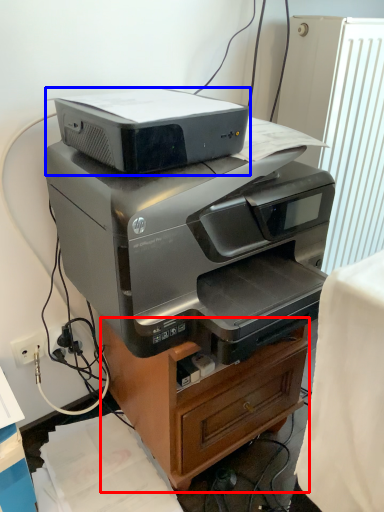
Question: Among these objects, which one is nearest to the camera, furniture (highlighted by a red box) or printer (highlighted by a blue box)?

Choices:
 (A) furniture
 (B) printer

Answer: (B)